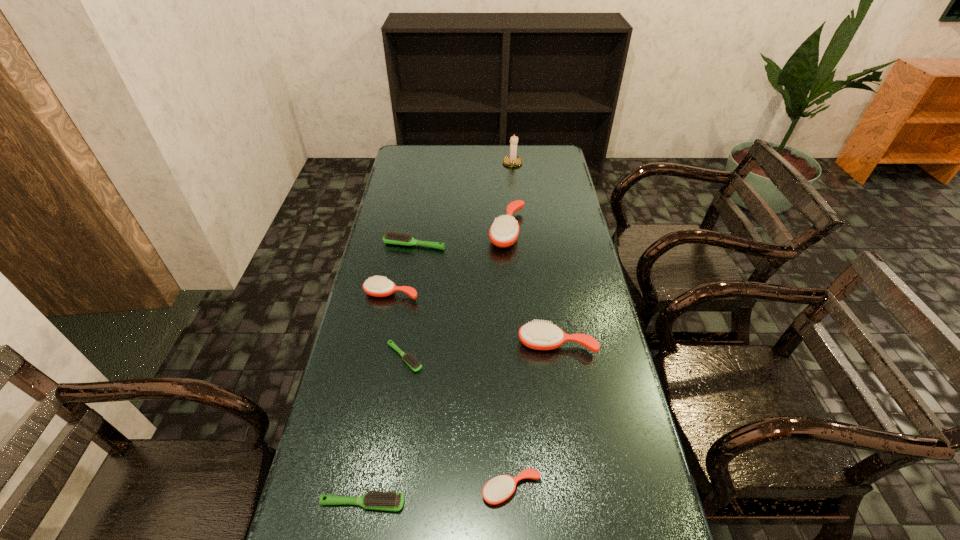
You are a GUI agent. You are given a task and a screenshot of the screen. Output one action in this format:
    pyautogui.click(x=<x>, y=<y>)
    Task: Click on the farthest object
    This screenshot has height=540, width=960.
    Given the screenshot: What is the action you would take?
    pyautogui.click(x=512, y=160)

This screenshot has width=960, height=540. In order to click on the tallest object in this screenshot , I will do `click(512, 160)`.

In order to click on the seventh shortest object in this screenshot , I will do `click(504, 231)`.

Where is `the farthest orange hairbrush`? the farthest orange hairbrush is located at coordinates (504, 231).

You are a GUI agent. You are given a task and a screenshot of the screen. Output one action in this format:
    pyautogui.click(x=<x>, y=<y>)
    Task: Click on the second nearest orange hairbrush
    
    Given the screenshot: What is the action you would take?
    pyautogui.click(x=537, y=335)

Locate an element on the screen. The image size is (960, 540). the sixth shortest hairbrush is located at coordinates (537, 335).

What are the coordinates of `the third nearest orange hairbrush` in the screenshot? It's located at (377, 286).

You are a GUI agent. You are given a task and a screenshot of the screen. Output one action in this format:
    pyautogui.click(x=<x>, y=<y>)
    Task: Click on the third biggest orange hairbrush
    The width and height of the screenshot is (960, 540).
    Given the screenshot: What is the action you would take?
    pyautogui.click(x=377, y=286)

Identify the location of the farthest light hairbrush. (392, 237).

Locate an element on the screen. The height and width of the screenshot is (540, 960). the smallest orange hairbrush is located at coordinates (498, 489).